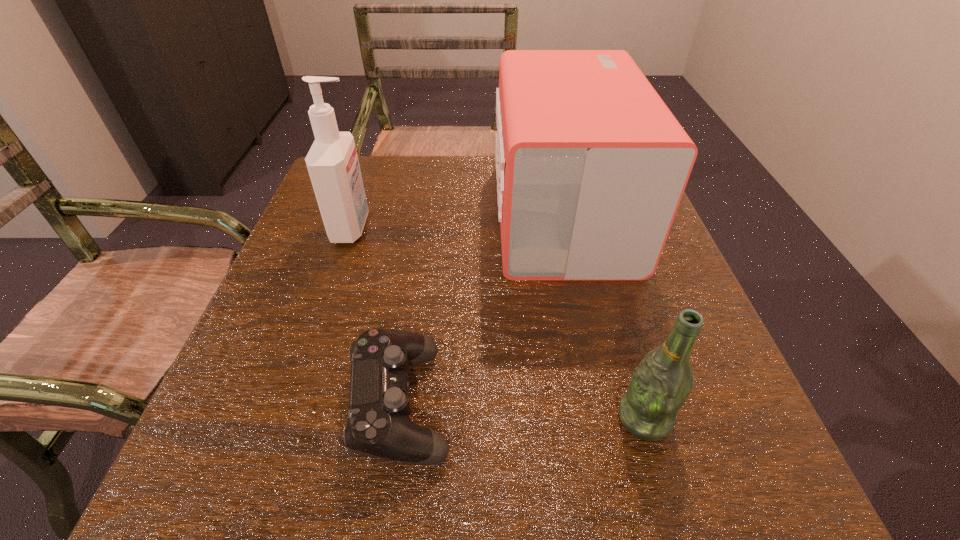
This screenshot has height=540, width=960. What are the coordinates of `vacant point located 0.240m on the surface of the second shortest object` in the screenshot? It's located at (456, 418).

Where is `free space located on the surface of the second shortest object`? free space located on the surface of the second shortest object is located at coordinates (530, 418).

Identify the location of vacant region located on the back of the shortest object. The height and width of the screenshot is (540, 960). (426, 222).

I want to click on object at the far edge, so click(x=591, y=165).

Locate an element on the screen. beer bottle at the near edge is located at coordinates (663, 380).

You are a GUI agent. You are given a task and a screenshot of the screen. Output one action in this format:
    pyautogui.click(x=<x>, y=<y>)
    Task: Click on the control at the near edge
    This screenshot has width=960, height=540.
    Given the screenshot: What is the action you would take?
    pyautogui.click(x=379, y=425)

Identify the location of object present at the left edge. This screenshot has height=540, width=960. (332, 162).

This screenshot has height=540, width=960. In order to click on box that is at the right edge in this screenshot , I will do `click(591, 165)`.

The image size is (960, 540). I want to click on beer bottle that is at the right edge, so click(663, 380).

The image size is (960, 540). In order to click on object located in the far right corner section of the desktop in this screenshot , I will do `click(591, 165)`.